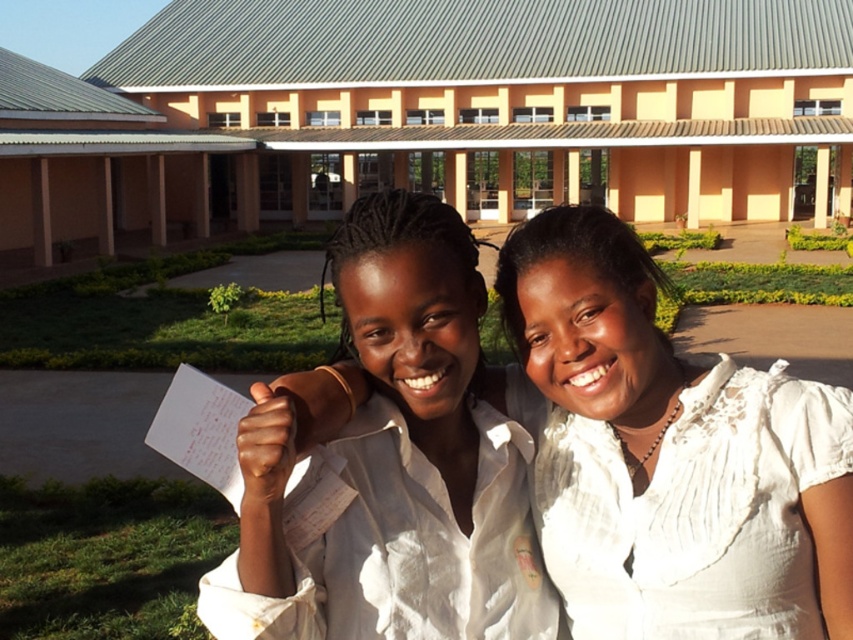
Does white cotton shirt at center appear on the right side of white pleated dress at center?

Incorrect, white cotton shirt at center is not on the right side of white pleated dress at center.

Does point (445, 586) lie in front of point (749, 476)?

No, (445, 586) is further to viewer.

You are a GUI agent. You are given a task and a screenshot of the screen. Output one action in this format:
    pyautogui.click(x=<x>, y=<y>)
    Task: Click on the white cotton shirt at center
    
    Given the screenshot: What is the action you would take?
    pyautogui.click(x=395, y=461)

Between beige concrete building at center and white pleated dress at center, which one appears on the right side from the viewer's perspective?

beige concrete building at center

Can you confirm if beige concrete building at center is positioned above white pleated dress at center?

Yes.

Between point (115, 128) and point (694, 408), which one is positioned in front?

Point (694, 408) is in front.

Where is `beige concrete building at center`? The width and height of the screenshot is (853, 640). beige concrete building at center is located at coordinates (428, 116).

Is beige concrete building at center to the right of white cotton shirt at center from the viewer's perspective?

Yes, beige concrete building at center is to the right of white cotton shirt at center.

Is beige concrete building at center bigger than white cotton shirt at center?

Yes.

Who is more distant from viewer, (230, 166) or (428, 256)?

The point (230, 166) is more distant.

The height and width of the screenshot is (640, 853). What are the coordinates of `beige concrete building at center` in the screenshot? It's located at (428, 116).